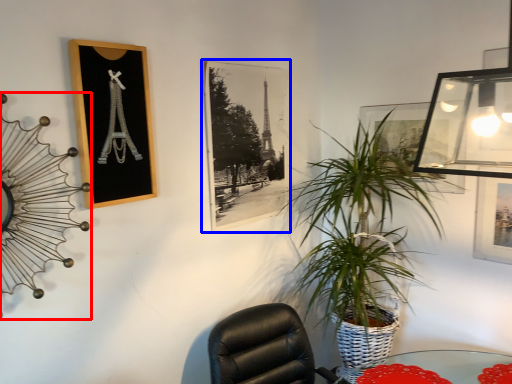
Question: Which point is closer to the camera, clock (highlighted by a red box) or picture frame (highlighted by a blue box)?

Choices:
 (A) clock
 (B) picture frame

Answer: (A)